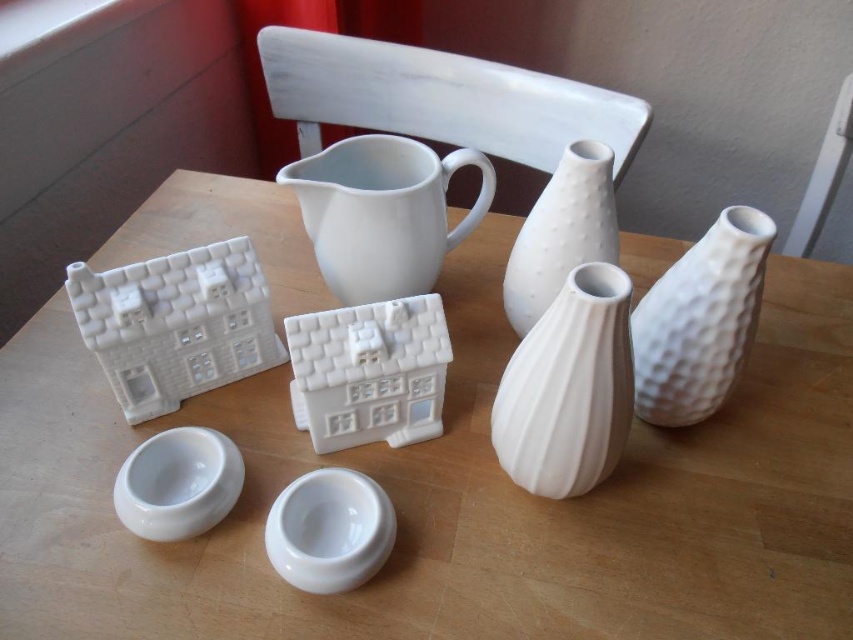
What is located at the coordinates point (x=454, y=499) in the image?

The white matte table at center is located at point (x=454, y=499).

You are standing in front of the wooden table with white ceramic items. There are two points marked on the table. One is at coordinate point [767,333] and the other is at point [335,481]. If you want to reach the point that is closer to you, which coordinate should you aim for?

Point [335,481] is closer to you because point [767,333] is behind it according to the spatial arrangement.

You are arranging items on a table and want to place a new decorative item between the white matte jug at center and the white textured vase at right. If the new item is 5 inches wide, will there be enough space between them?

The distance between the white matte jug at center and the white textured vase at right is 9.81 inches. Since the new item is 5 inches wide, there is sufficient space as 5 inches is less than 9.81 inches.